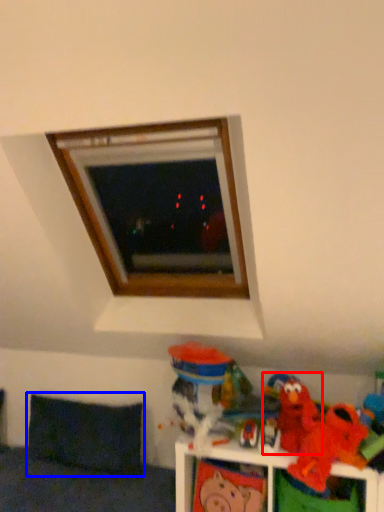
Question: Which object is closer to the camera taking this photo, toy (highlighted by a red box) or pillow (highlighted by a blue box)?

Choices:
 (A) toy
 (B) pillow

Answer: (A)